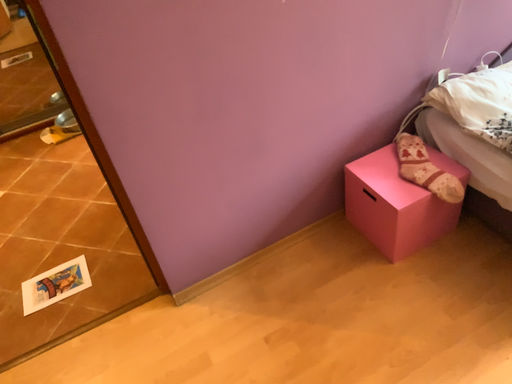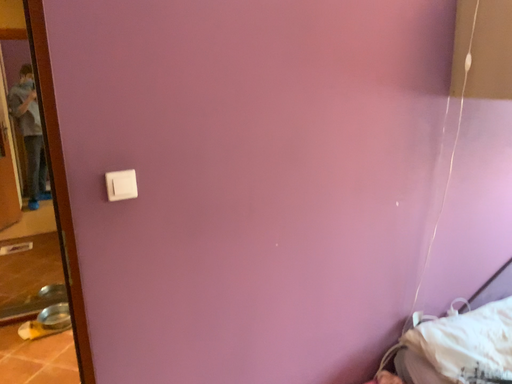
Question: How did the camera likely rotate when shooting the video?

Choices:
 (A) rotated upward
 (B) rotated downward

Answer: (A)